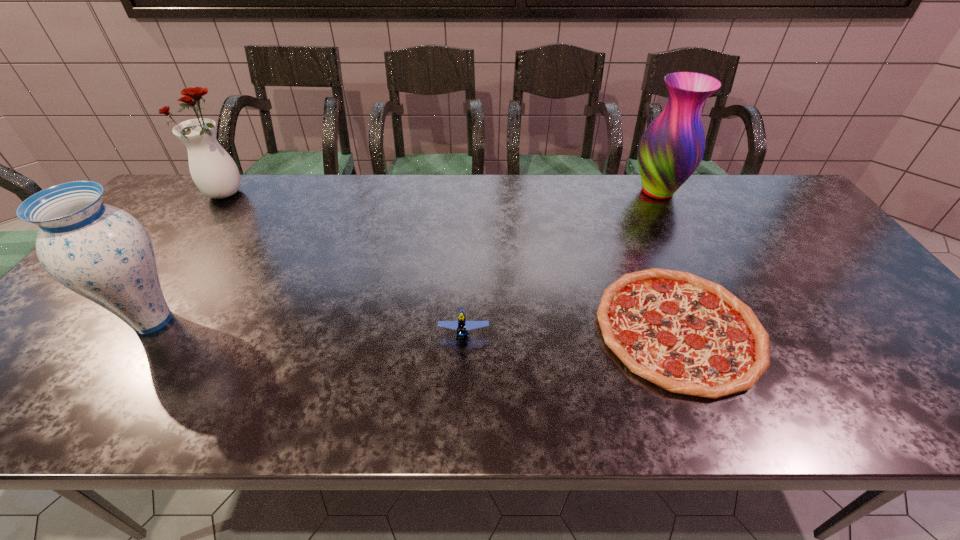
You are a GUI agent. You are given a task and a screenshot of the screen. Output one action in this format:
    pyautogui.click(x=<x>, y=<y>)
    Task: Click on the free area in between the rightmost vase and the second shortest object
    Image resolution: width=960 pixels, height=540 pixels.
    Given the screenshot: What is the action you would take?
    pyautogui.click(x=561, y=262)

Locate which object ranks second in proximity to the nearest vase. Please provide its 2D coordinates. Your answer should be formatted as a tuple, i.e. [(x, y)], where the tuple contains the x and y coordinates of a point satisfying the conditions above.

[(462, 325)]

Find the location of a particular element. The width and height of the screenshot is (960, 540). object that is the second closest one to the pizza is located at coordinates (672, 147).

Locate which vase ranks in proximity to the rightmost vase. Please provide its 2D coordinates. Your answer should be formatted as a tuple, i.e. [(x, y)], where the tuple contains the x and y coordinates of a point satisfying the conditions above.

[(101, 252)]

Locate which vase ranks in proximity to the nearest vase. Please provide its 2D coordinates. Your answer should be formatted as a tuple, i.e. [(x, y)], where the tuple contains the x and y coordinates of a point satisfying the conditions above.

[(213, 170)]